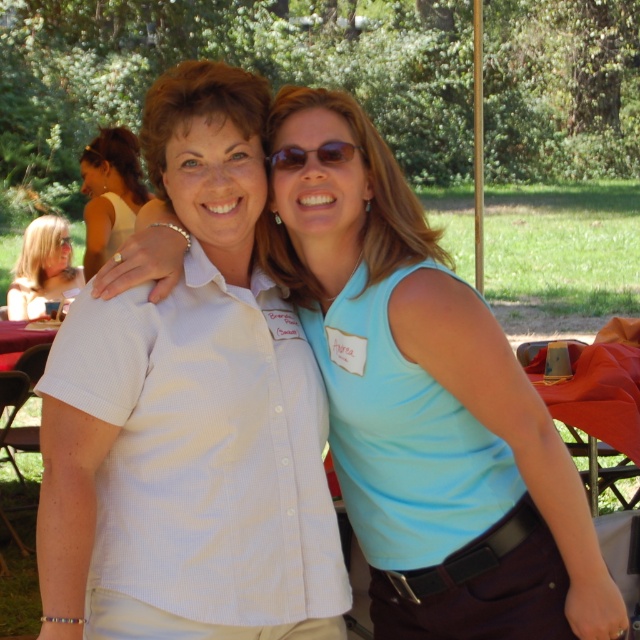
You are a photographer at a social event and need to take a photo of both women with their name tags visible. Since the white woven shirt at center is below blonde hair at upper left, will the name tags be visible in the photo?

The white woven shirt at center is below blonde hair at upper left, so the name tags will be visible as the shirt and hair are positioned in a way that doesn not block them.

You are a photographer at a social event and want to capture a photo of both Andrea wearing a light colored short sleeved button up shirt and Andrea wearing a sleeveless light blue top. You need to ensure that the white woven shirt at center is not in the frame. Where should you position yourself relative to the point at (426,403) to avoid including the white woven shirt at center in the photo?

To avoid including the white woven shirt at center located at point (426,403), position yourself either to the left or right of this point, ensuring the camera is angled away from the center area where the white woven shirt at center is positioned.

You are at a social event and need to find the shortest path to the exit, which is located at point (48, 259). There is an obstacle at point (92, 224). Can you go around it directly to reach the exit?

Point (92, 224) is in front of point (48, 259), so you cannot go directly to the exit because the obstacle is blocking the path.